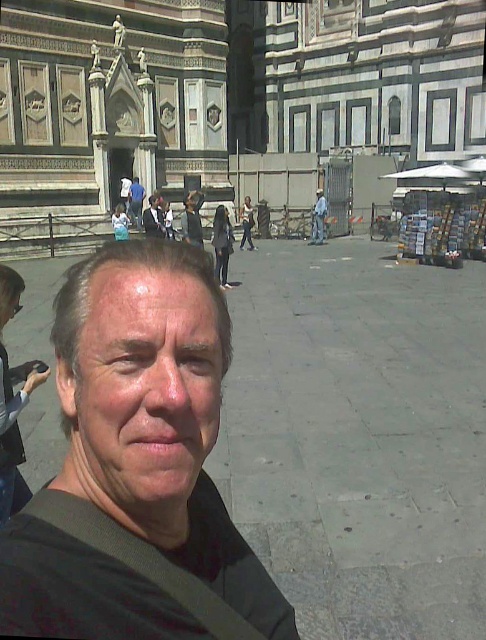
You are standing at the point closest to the camera in the image. The two points are labeled as point 1 at coordinates point (157, 528) and point 2 at coordinates point (320, 193). Which point are you standing at?

You are standing at point (157, 528) because it is in front of point (320, 193), so it is closer to the camera.

You are a photographer trying to capture the entire scene of the cathedral and the person in the foreground. Given that the matte black shirt at center and light blue jeans at center are 161.12 feet apart, what adjustment should you make to your camera to ensure both the cathedral and the person are in focus?

To ensure both the matte black shirt at center and light blue jeans at center are in focus, you should adjust your camera to a smaller aperture setting, which increases the depth of field, allowing both the foreground person and the distant cathedral to be sharp.

You are a photographer trying to capture the cathedral in the background. You notice the matte black shirt at center and the light blue jeans at center. Which clothing item is closer to the camera?

The matte black shirt at center is closer to the viewer than the light blue jeans at center, so the matte black shirt at center would appear closer in the photo.